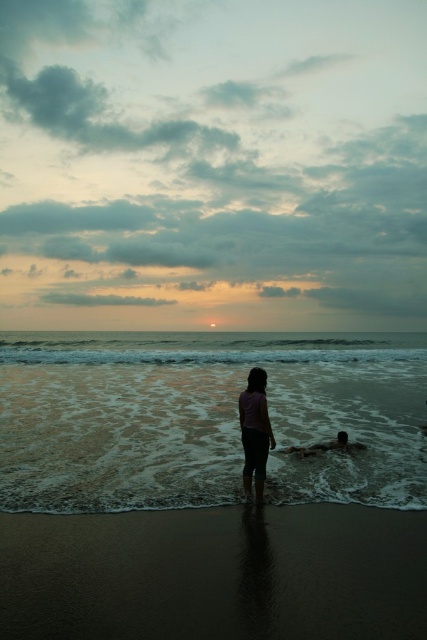
You are standing on the beach and want to place a small flag exactly at the location of the dark brown sand at lower center. What coordinates should you aim for?

The coordinates for the dark brown sand at lower center are 0.897 on the x and 0.504 on the y axis.

You are standing on the beach and see the pink fabric at center and the smooth skin person at lower center. Which object is nearer to you?

The pink fabric at center is closer to the viewer than the smooth skin person at lower center.